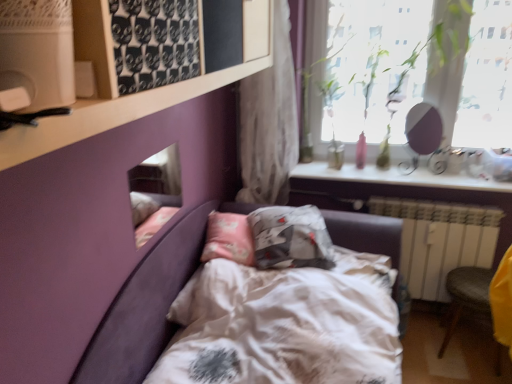
What do you see at coordinates (120, 108) in the screenshot? The image size is (512, 384). I see `white matte shelf at upper left` at bounding box center [120, 108].

Measure the distance between point (444, 229) and camera.

Point (444, 229) is 7.44 feet from camera.

Describe the element at coordinates (485, 81) in the screenshot. I see `transparent glass window at upper right` at that location.

The image size is (512, 384). Describe the element at coordinates (269, 122) in the screenshot. I see `white textured curtain at upper center` at that location.

Where is `white matte shelf at upper left`? This screenshot has width=512, height=384. white matte shelf at upper left is located at coordinates (120, 108).

Is white painted metal radiator at lower right at the left side of matte purple mirror at upper right, which is counted as the first mirror, starting from the right?

No, white painted metal radiator at lower right is not to the left of matte purple mirror at upper right, which is counted as the first mirror, starting from the right.

How far apart are white painted metal radiator at lower right and matte purple mirror at upper right, which appears as the 1th mirror when viewed from the back?

white painted metal radiator at lower right and matte purple mirror at upper right, which appears as the 1th mirror when viewed from the back, are 40.04 centimeters apart.

Does white painted metal radiator at lower right have a larger size compared to matte purple mirror at upper right, which appears as the 1th mirror when viewed from the back?

Yes.

Is white painted metal radiator at lower right positioned before matte purple mirror at upper right, which appears as the 1th mirror when viewed from the back?

That is True.

Is matte purple mirror at upper right, which appears as the 1th mirror when viewed from the back, at the right side of yellow fabric armchair at lower right?

Incorrect, matte purple mirror at upper right, which appears as the 1th mirror when viewed from the back, is not on the right side of yellow fabric armchair at lower right.

Who is smaller, matte purple mirror at upper right, which is counted as the 2th mirror, starting from the left, or yellow fabric armchair at lower right?

matte purple mirror at upper right, which is counted as the 2th mirror, starting from the left.

Could you tell me if matte purple mirror at upper right, which is counted as the 2th mirror, starting from the left, is facing yellow fabric armchair at lower right?

No, matte purple mirror at upper right, which is counted as the 2th mirror, starting from the left, is not aimed at yellow fabric armchair at lower right.

Does yellow fabric armchair at lower right appear on the left side of matte purple mirror at upper right, which ranks as the second mirror in front-to-back order?

No.

How different are the orientations of yellow fabric armchair at lower right and matte purple mirror at upper right, which appears as the 1th mirror when viewed from the back, in degrees?

The angular difference between yellow fabric armchair at lower right and matte purple mirror at upper right, which appears as the 1th mirror when viewed from the back, is 11.6 degrees.

Is point (509, 289) positioned before point (439, 144)?

Yes.

Does yellow fabric armchair at lower right come in front of matte purple mirror at upper right, which is counted as the 2th mirror, starting from the left?

That is True.

Considering the relative positions of white textured curtain at upper center and transparent glass window at upper right in the image provided, is white textured curtain at upper center behind transparent glass window at upper right?

No, white textured curtain at upper center is in front of transparent glass window at upper right.

How many degrees apart are the facing directions of white textured curtain at upper center and transparent glass window at upper right?

They differ by 0.899 degrees in their facing directions.

Do you think white textured curtain at upper center is within transparent glass window at upper right, or outside of it?

white textured curtain at upper center is outside transparent glass window at upper right.

Which point is more forward, [255,107] or [401,20]?

Point [401,20]

Which of these two, white painted metal radiator at lower right or transparent glass window at upper right, is wider?

Wider between the two is white painted metal radiator at lower right.

Considering the sizes of objects white painted metal radiator at lower right and transparent glass window at upper right in the image provided, who is bigger, white painted metal radiator at lower right or transparent glass window at upper right?

With larger size is white painted metal radiator at lower right.

Is white painted metal radiator at lower right positioned behind transparent glass window at upper right?

Yes, white painted metal radiator at lower right is further from the viewer.

Is point (457, 259) positioned behind point (338, 63)?

No, (457, 259) is closer to viewer.

In terms of width, does yellow fabric armchair at lower right look wider or thinner when compared to matte glass mirror at upper left, which is the first mirror in front-to-back order?

Considering their sizes, yellow fabric armchair at lower right looks broader than matte glass mirror at upper left, which is the first mirror in front-to-back order.

Is yellow fabric armchair at lower right oriented away from matte glass mirror at upper left, which is the first mirror in front-to-back order?

No, matte glass mirror at upper left, which is the first mirror in front-to-back order, is not at the back of yellow fabric armchair at lower right.

Considering the relative positions of yellow fabric armchair at lower right and matte glass mirror at upper left, which appears as the 1th mirror when viewed from the left, in the image provided, is yellow fabric armchair at lower right in front of matte glass mirror at upper left, which appears as the 1th mirror when viewed from the left,?

No, it is not.

Is yellow fabric armchair at lower right inside the boundaries of matte glass mirror at upper left, which appears as the 1th mirror when viewed from the left, or outside?

yellow fabric armchair at lower right is spatially situated outside matte glass mirror at upper left, which appears as the 1th mirror when viewed from the left.

Is white textured curtain at upper center situated inside white satin bed at center or outside?

white textured curtain at upper center is spatially situated outside white satin bed at center.

Who is taller, white textured curtain at upper center or white satin bed at center?

Standing taller between the two is white textured curtain at upper center.

Who is bigger, white textured curtain at upper center or white satin bed at center?

white satin bed at center is bigger.

From the image's perspective, is white textured curtain at upper center located above or below white satin bed at center?

white textured curtain at upper center is situated higher than white satin bed at center in the image.

At what (x,y) coordinates should I click in order to perform the action: click on radiator below the matte purple mirror at upper right, which is counted as the 2th mirror, starting from the left (from a real-world perspective). Please return your answer as a coordinate pair (x, y). Looking at the image, I should click on 440,240.

Where is `the 1st mirror to the left when counting from the yellow fabric armchair at lower right`? the 1st mirror to the left when counting from the yellow fabric armchair at lower right is located at coordinates (422, 134).

Estimate the real-world distances between objects in this image. Which object is further from white satin bed at center, transparent glass window at upper right or white textured curtain at upper center?

transparent glass window at upper right.

Considering their positions, is matte purple mirror at upper right, which is counted as the first mirror, starting from the right, positioned further to white textured curtain at upper center than white satin bed at center?

white satin bed at center.

From the image, which object appears to be nearer to transparent glass window at upper right, matte glass mirror at upper left, which appears as the 1th mirror when viewed from the left, or yellow fabric armchair at lower right?

yellow fabric armchair at lower right is closer to transparent glass window at upper right.

From the picture: Which object lies nearer to the anchor point white satin bed at center, white glossy shelf at upper right or yellow fabric armchair at lower right?

yellow fabric armchair at lower right is positioned closer to the anchor white satin bed at center.

Estimate the real-world distances between objects in this image. Which object is further from white glossy shelf at upper right, matte glass mirror at upper left, which appears as the 1th mirror when viewed from the left, or matte purple mirror at upper right, which appears as the 1th mirror when viewed from the back?

matte glass mirror at upper left, which appears as the 1th mirror when viewed from the left, lies further to white glossy shelf at upper right than the other object.

Looking at the image, which one is located closer to white painted metal radiator at lower right, white textured curtain at upper center or white satin bed at center?

white satin bed at center.

Based on their spatial positions, is white satin bed at center or transparent glass window at upper right closer to white matte shelf at upper left?

white satin bed at center is positioned closer to the anchor white matte shelf at upper left.

When comparing their distances from white textured curtain at upper center, does matte glass mirror at upper left, acting as the second mirror starting from the right, or white painted metal radiator at lower right seem further?

white painted metal radiator at lower right is positioned further to the anchor white textured curtain at upper center.

At what (x,y) coordinates should I click in order to perform the action: click on window sill between white satin bed at center and white painted metal radiator at lower right along the z-axis. Please return your answer as a coordinate pair (x, y). Looking at the image, I should click on (396, 177).

Where is `window sill positioned between white matte shelf at upper left and matte purple mirror at upper right, which is counted as the 2th mirror, starting from the left, from near to far`? This screenshot has width=512, height=384. window sill positioned between white matte shelf at upper left and matte purple mirror at upper right, which is counted as the 2th mirror, starting from the left, from near to far is located at coordinates (396, 177).

Where is `mirror between transparent glass window at upper right and white glossy shelf at upper right vertically`? The width and height of the screenshot is (512, 384). mirror between transparent glass window at upper right and white glossy shelf at upper right vertically is located at coordinates (422, 134).

At what (x,y) coordinates should I click in order to perform the action: click on window sill situated between matte glass mirror at upper left, which appears as the 1th mirror when viewed from the left, and matte purple mirror at upper right, which is counted as the 2th mirror, starting from the left, from left to right. Please return your answer as a coordinate pair (x, y). The image size is (512, 384). Looking at the image, I should click on (396, 177).